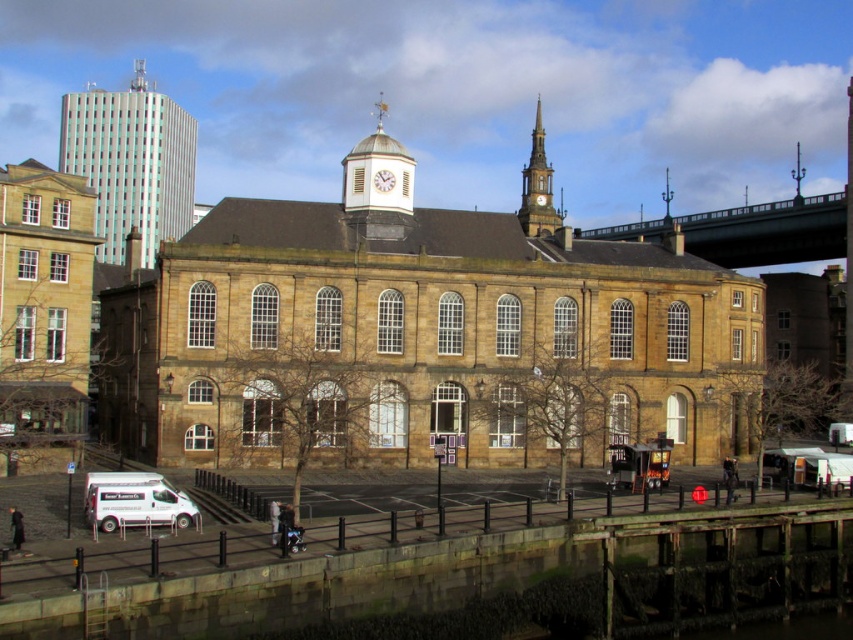
Is point (107, 224) positioned in front of point (534, 145)?

No.

Identify the location of metallic glass tower at upper left. pos(131,163).

In order to click on metallic glass tower at upper left in this screenshot , I will do `click(131, 163)`.

Is point (213, 256) positioned behind point (3, 440)?

Yes, it is.

Can you confirm if brown stone church at center is positioned to the right of brown stone church at left?

Indeed, brown stone church at center is positioned on the right side of brown stone church at left.

Is point (289, 355) farther from camera compared to point (83, 435)?

Yes, it is behind point (83, 435).

The image size is (853, 640). I want to click on brown stone church at center, so click(x=444, y=330).

Between brown stone church at center and green metallic bridge at upper right, which one is positioned lower?

brown stone church at center

Between brown stone church at center and green metallic bridge at upper right, which one is positioned higher?

green metallic bridge at upper right is above.

This screenshot has width=853, height=640. What are the coordinates of `brown stone church at center` in the screenshot? It's located at (444, 330).

The height and width of the screenshot is (640, 853). In order to click on brown stone church at center in this screenshot , I will do `click(444, 330)`.